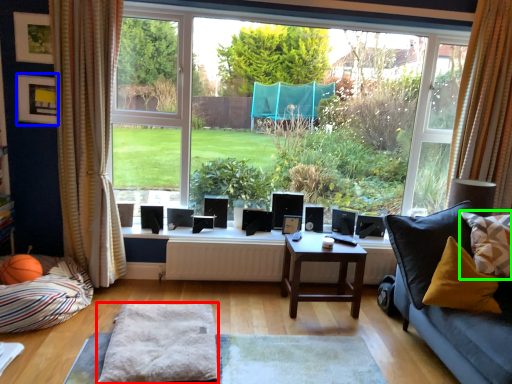
Question: Based on their relative distances, which object is nearer to gray (highlighted by a red box)? Choose from picture frame (highlighted by a blue box) and pillow (highlighted by a green box).

Choices:
 (A) picture frame
 (B) pillow

Answer: (A)